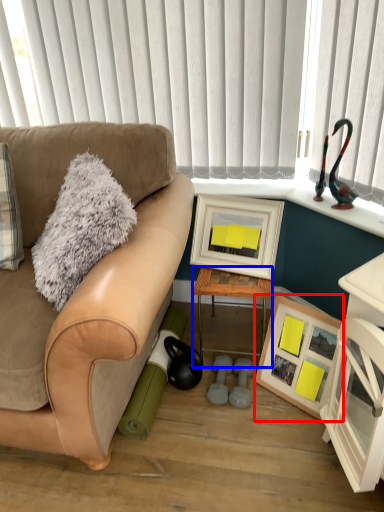
Question: Which object is further to the camera taking this photo, picture frame (highlighted by a red box) or table (highlighted by a blue box)?

Choices:
 (A) picture frame
 (B) table

Answer: (B)